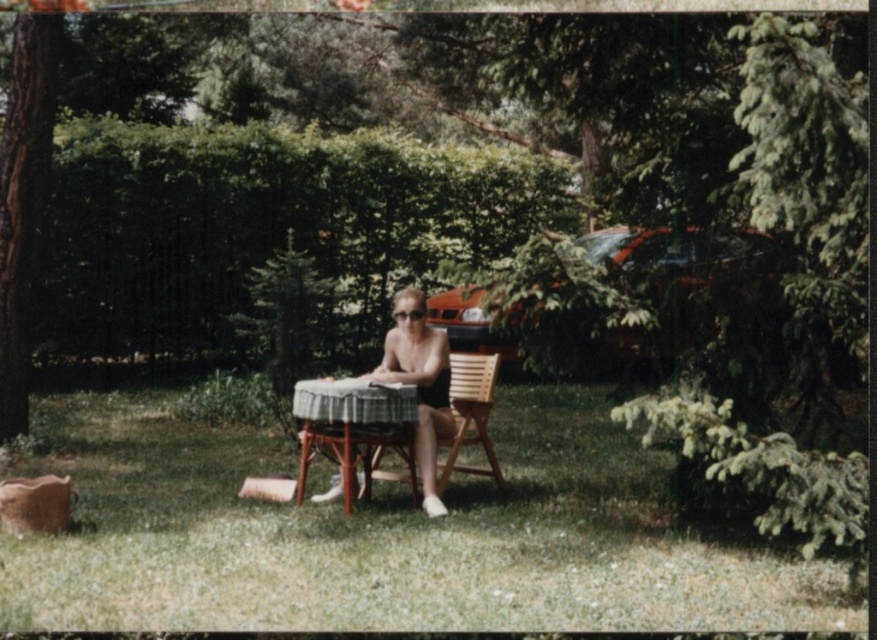
Question: Which object is positioned closest to the matte plastic woman at center?

Choices:
 (A) wooden table at center
 (B) smooth brown tree trunk at left

Answer: (A)

Question: Is smooth brown tree trunk at left below wooden chair at center?

Choices:
 (A) yes
 (B) no

Answer: (B)

Question: Estimate the real-world distances between objects in this image. Which object is farther from the matte plastic woman at center?

Choices:
 (A) wooden chair at center
 (B) wooden table at center

Answer: (B)

Question: Considering the real-world distances, which object is farthest from the matte plastic woman at center?

Choices:
 (A) smooth brown tree trunk at left
 (B) wooden chair at center
 (C) wooden table at center

Answer: (A)

Question: Can you confirm if smooth brown tree trunk at left is positioned to the left of matte plastic woman at center?

Choices:
 (A) no
 (B) yes

Answer: (B)

Question: Does wooden table at center lie in front of wooden chair at center?

Choices:
 (A) no
 (B) yes

Answer: (B)